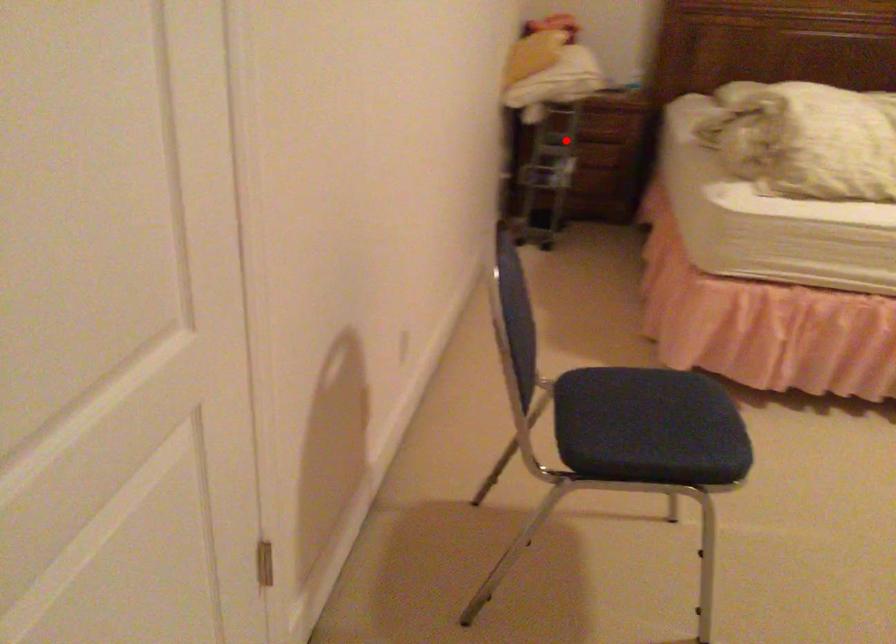
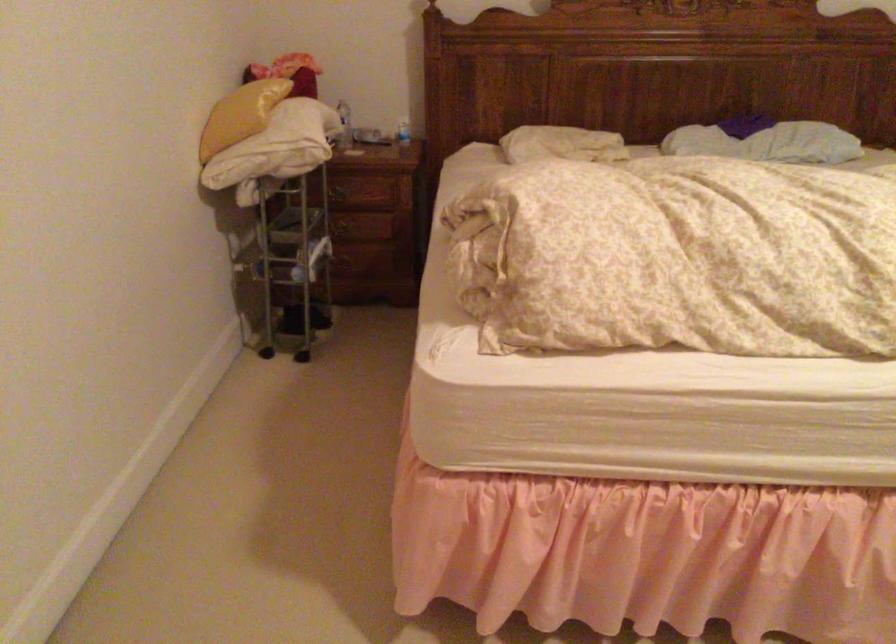
Question: I am providing you with two images of the same scene from different viewpoints. Image1 has a red point marked. In image2, the corresponding 3D location appears at what relative position? Reply with the corresponding letter.

Choices:
 (A) Closer
 (B) Farther

Answer: (A)